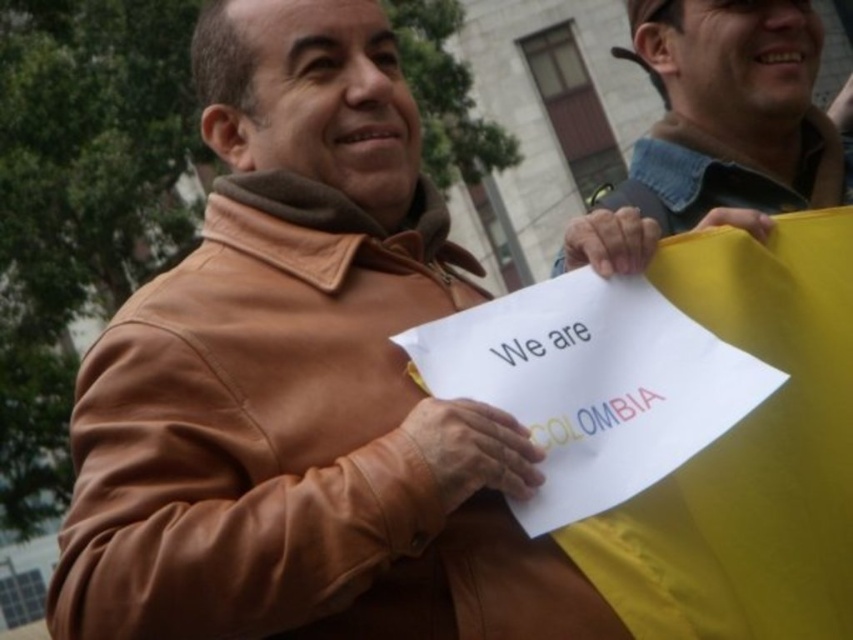
Can you confirm if brown leather jacket at center is taller than denim jacket at upper right?

Yes, brown leather jacket at center is taller than denim jacket at upper right.

Which is more to the right, brown leather jacket at center or denim jacket at upper right?

denim jacket at upper right is more to the right.

Which is behind, point (415, 620) or point (801, 147)?

The point (801, 147) is behind.

Where is `brown leather jacket at center`? brown leather jacket at center is located at coordinates (302, 385).